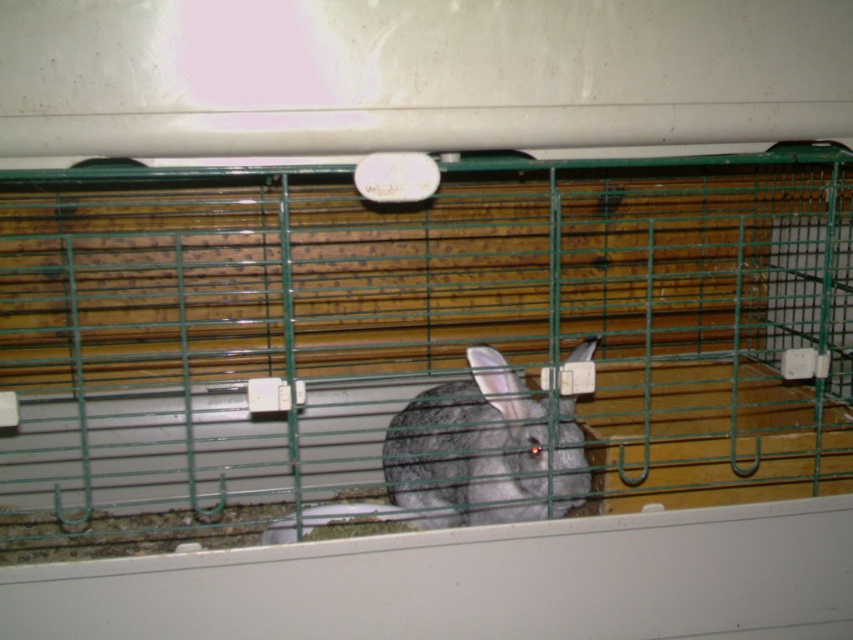
Does green wire cage at center appear under gray furry rabbit at center?

Actually, green wire cage at center is above gray furry rabbit at center.

Is green wire cage at center in front of gray furry rabbit at center?

Yes.

Does point (247, 372) come in front of point (424, 488)?

No, it is not.

This screenshot has height=640, width=853. In order to click on green wire cage at center in this screenshot , I will do `click(415, 332)`.